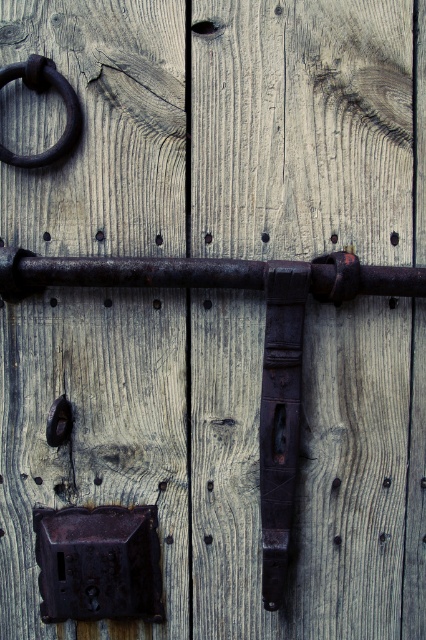
Is point (77, 609) less distant than point (55, 72)?

No, it is behind (55, 72).

Can you confirm if rusty metal lock at lower left is smaller than rusty metal ring at upper left?

Actually, rusty metal lock at lower left might be larger than rusty metal ring at upper left.

This screenshot has width=426, height=640. What do you see at coordinates (98, 563) in the screenshot? I see `rusty metal lock at lower left` at bounding box center [98, 563].

Find the location of a particular element. rusty metal lock at lower left is located at coordinates (98, 563).